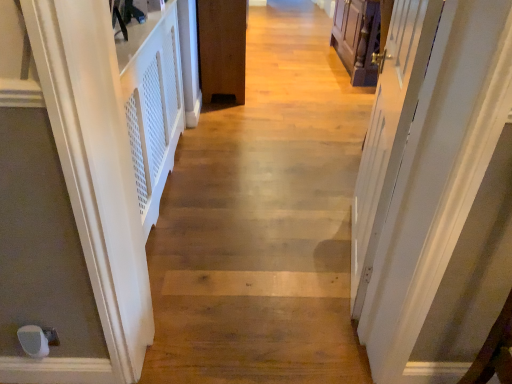
Find the location of a particular element. The height and width of the screenshot is (384, 512). empty space that is ontop of natural wood floor at center (from a real-world perspective) is located at coordinates (297, 103).